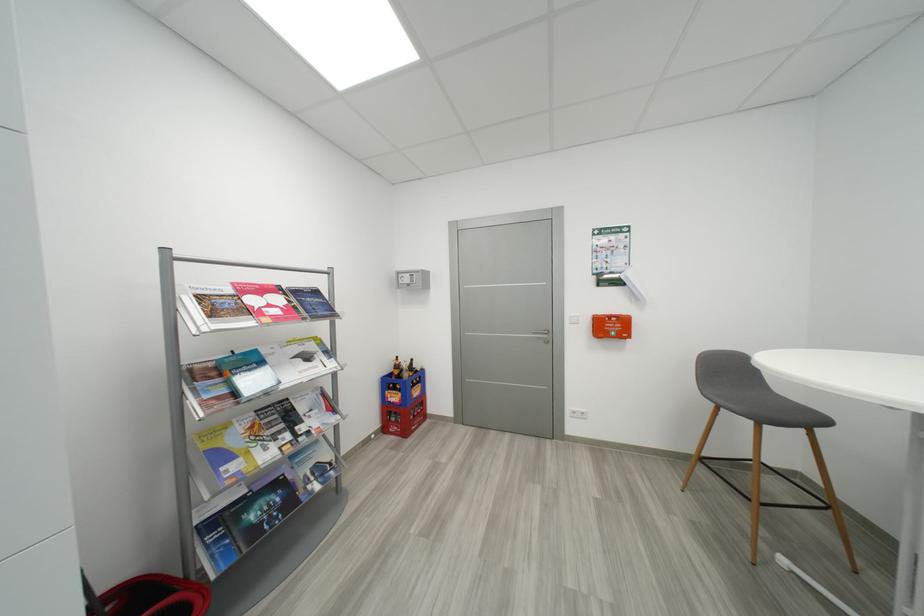
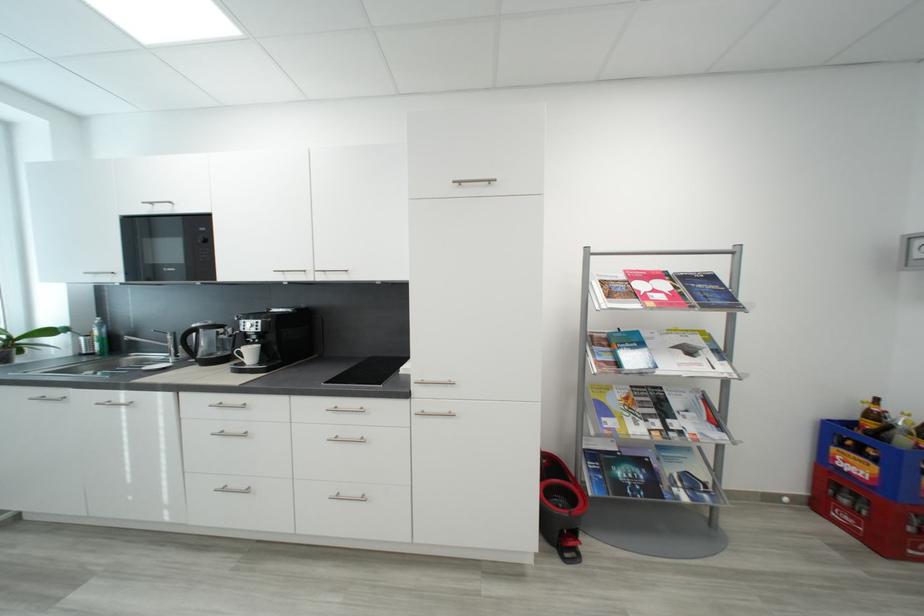
In the second image, find the point that corresponds to point (309, 410) in the first image.

(684, 406)